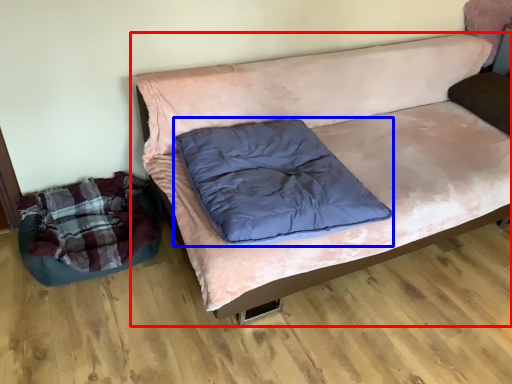
Question: Among these objects, which one is farthest to the camera, studio couch (highlighted by a red box) or pillow (highlighted by a blue box)?

Choices:
 (A) studio couch
 (B) pillow

Answer: (B)